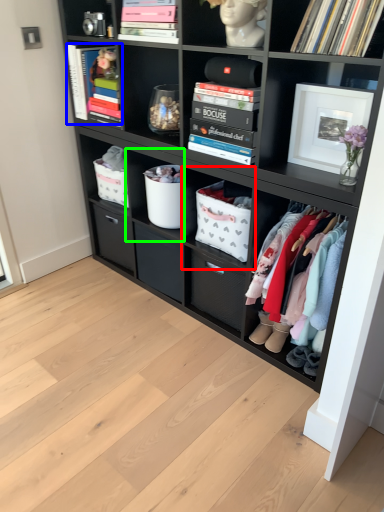
Question: Which object is the farthest from shelf (highlighted by a red box)? Choose among these: magazine (highlighted by a blue box) or shelf (highlighted by a green box).

Choices:
 (A) magazine
 (B) shelf

Answer: (A)